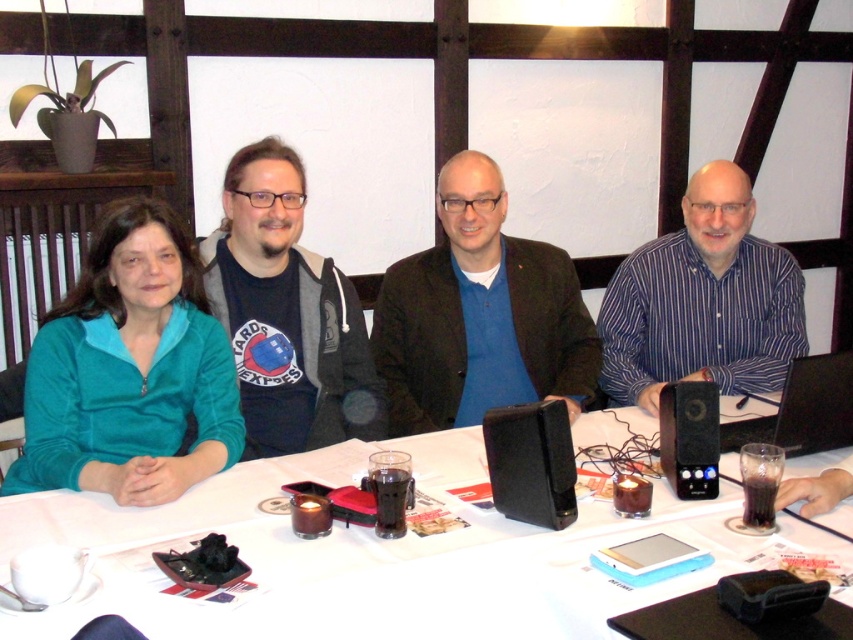
Question: Estimate the real-world distances between objects in this image. Which object is closer to the matte black hoodie at center?

Choices:
 (A) blue striped shirt at center
 (B) black plastic speaker at lower right
 (C) black plastic laptop at right

Answer: (B)

Question: Which point appears farthest from the camera in this image?

Choices:
 (A) (489, 301)
 (B) (74, 416)

Answer: (A)

Question: Considering the relative positions of white paper table at center and teal fleece jacket at left in the image provided, where is white paper table at center located with respect to teal fleece jacket at left?

Choices:
 (A) right
 (B) left

Answer: (A)

Question: Does matte black hoodie at center appear over black plastic laptop at right?

Choices:
 (A) yes
 (B) no

Answer: (A)

Question: Which of the following is the farthest from the observer?

Choices:
 (A) blue matte jacket at center
 (B) blue striped shirt at center

Answer: (A)

Question: Does matte black hoodie at center appear on the left side of black plastic laptop at right?

Choices:
 (A) yes
 (B) no

Answer: (A)